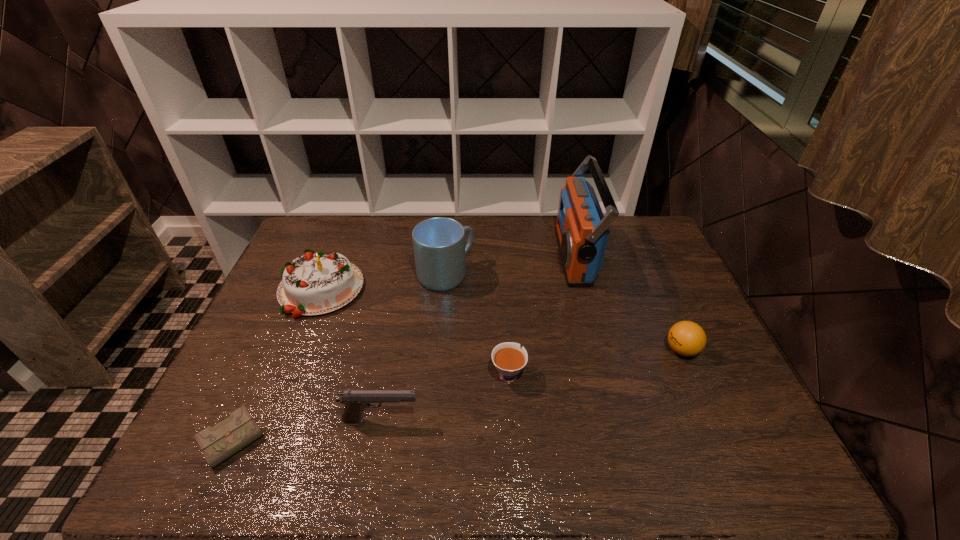
Locate an element on the screen. vacant point located on the side of the sixth tallest object with the handle is located at coordinates (503, 284).

At what (x,y) coordinates should I click in order to perform the action: click on free space located 0.110m on the side of the sixth tallest object with the handle. Please return your answer as a coordinate pair (x, y). Image resolution: width=960 pixels, height=540 pixels. Looking at the image, I should click on (506, 327).

The image size is (960, 540). I want to click on vacant region located 0.160m on the back of the shortest object, so (272, 359).

Where is `object that is at the far edge`? This screenshot has height=540, width=960. object that is at the far edge is located at coordinates (582, 231).

Identify the location of object located at the near edge. This screenshot has height=540, width=960. (218, 443).

Find the location of a particular element. cake located in the left edge section of the desktop is located at coordinates (314, 284).

You are a GUI agent. You are given a task and a screenshot of the screen. Output one action in this format:
    pyautogui.click(x=<x>, y=<y>)
    Task: Click on the diary that is positioned at the left edge
    This screenshot has height=540, width=960.
    Given the screenshot: What is the action you would take?
    pyautogui.click(x=218, y=443)

The width and height of the screenshot is (960, 540). Identify the location of object at the right edge. (686, 338).

The height and width of the screenshot is (540, 960). In order to click on object located at the near left corner in this screenshot , I will do `click(218, 443)`.

In order to click on vacant space at the far edge of the desktop in this screenshot , I will do `click(465, 215)`.